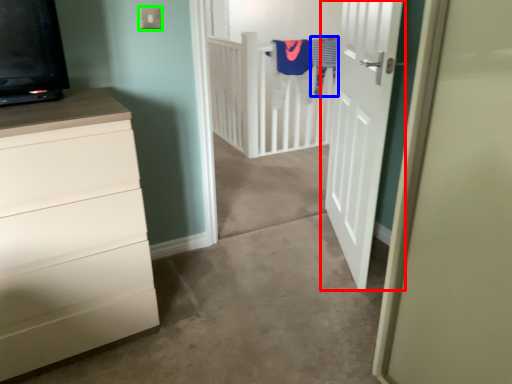
Question: Which is nearer to the door (highlighted by a red box)? laundry (highlighted by a blue box) or electric outlet (highlighted by a green box).

Choices:
 (A) laundry
 (B) electric outlet

Answer: (B)